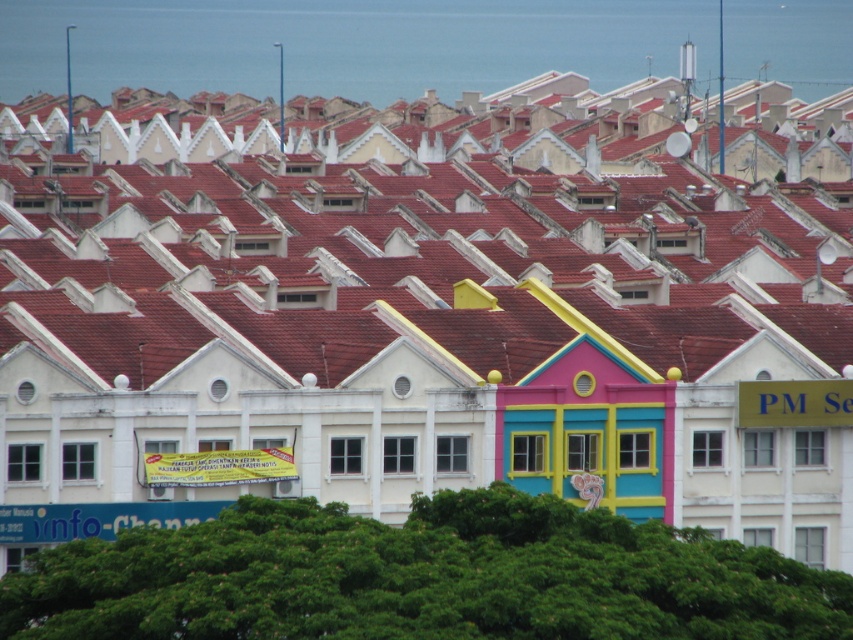
Where is `red clay tiles at center`? red clay tiles at center is located at coordinates (428, 244).

Is red clay tiles at center further to camera compared to multicolored painted house at center?

No, red clay tiles at center is closer to the viewer.

Identify the location of red clay tiles at center. This screenshot has height=640, width=853. (428, 244).

Identify the location of red clay tiles at center. (428, 244).